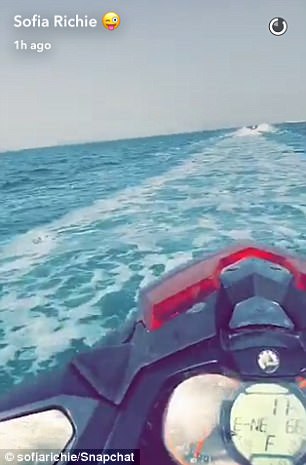
Where is `mirror`? The height and width of the screenshot is (465, 306). mirror is located at coordinates (54, 430).